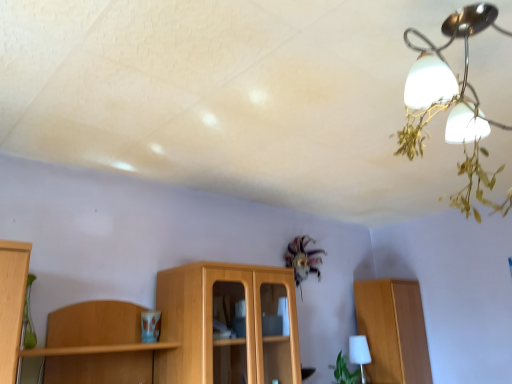
At what (x,y) coordinates should I click in order to perform the action: click on white matte table lamp at lower right. Please return your answer as a coordinate pair (x, y). This screenshot has width=512, height=384. Looking at the image, I should click on (359, 353).

The height and width of the screenshot is (384, 512). I want to click on satin silver chandelier at upper right, so click(x=451, y=103).

Is satin silver chandelier at upper right far away from white matte table lamp at lower right?

Yes, satin silver chandelier at upper right and white matte table lamp at lower right are located far from each other.

Could you tell me if satin silver chandelier at upper right is facing white matte table lamp at lower right?

No, satin silver chandelier at upper right is not oriented towards white matte table lamp at lower right.

Does point (486, 152) come in front of point (350, 348)?

That is True.

At what (x,y) coordinates should I click in order to perform the action: click on lamp above the white matte table lamp at lower right (from the image's perspective). Please return your answer as a coordinate pair (x, y). This screenshot has width=512, height=384. Looking at the image, I should click on (451, 103).

Can you confirm if white matte table lamp at lower right is taller than satin silver chandelier at upper right?

In fact, white matte table lamp at lower right may be shorter than satin silver chandelier at upper right.

In the scene shown: Would you say white matte table lamp at lower right is inside or outside satin silver chandelier at upper right?

white matte table lamp at lower right cannot be found inside satin silver chandelier at upper right.

Which is farther from the camera, (362, 336) or (410, 121)?

Positioned behind is point (362, 336).

Is white matte table lamp at lower right completely or partially outside of green leafy plant at lower right?

Yes, white matte table lamp at lower right is located beyond the bounds of green leafy plant at lower right.

Can you confirm if white matte table lamp at lower right is taller than green leafy plant at lower right?

Yes, white matte table lamp at lower right is taller than green leafy plant at lower right.

Considering the sizes of wooden cabinet at right and white matte table lamp at lower right in the image, is wooden cabinet at right taller or shorter than white matte table lamp at lower right?

Considering their sizes, wooden cabinet at right has more height than white matte table lamp at lower right.

Is wooden cabinet at right placed right next to white matte table lamp at lower right?

No, wooden cabinet at right is not making contact with white matte table lamp at lower right.

Which is behind, point (368, 336) or point (362, 368)?

The point (368, 336) is behind.

Considering the relative positions of satin silver chandelier at upper right and wooden cabinet at right in the image provided, is satin silver chandelier at upper right to the left or to the right of wooden cabinet at right?

Clearly, satin silver chandelier at upper right is on the left of wooden cabinet at right in the image.

In the scene shown: Which object is closer to the camera taking this photo, satin silver chandelier at upper right or wooden cabinet at right?

satin silver chandelier at upper right is in front.

From the image's perspective, is satin silver chandelier at upper right located above or below wooden cabinet at right?

Clearly, from the image's perspective, satin silver chandelier at upper right is above wooden cabinet at right.

At what (x,y) coordinates should I click in order to perform the action: click on plant located in front of the white matte table lamp at lower right. Please return your answer as a coordinate pair (x, y). Image resolution: width=512 pixels, height=384 pixels. Looking at the image, I should click on (345, 371).

Looking at the image, does green leafy plant at lower right seem bigger or smaller compared to white matte table lamp at lower right?

Considering their sizes, green leafy plant at lower right takes up more space than white matte table lamp at lower right.

Is green leafy plant at lower right oriented towards white matte table lamp at lower right?

No.

In the scene shown: Is green leafy plant at lower right situated inside white matte table lamp at lower right or outside?

green leafy plant at lower right is spatially situated outside white matte table lamp at lower right.

Does wooden cabinet at right have a greater height compared to green leafy plant at lower right?

Yes, wooden cabinet at right is taller than green leafy plant at lower right.

From the image's perspective, does wooden cabinet at right appear higher than green leafy plant at lower right?

Yes, from the image's perspective, wooden cabinet at right is on top of green leafy plant at lower right.

In the image, is wooden cabinet at right positioned in front of or behind green leafy plant at lower right?

Visually, wooden cabinet at right is located behind green leafy plant at lower right.

Where is `lamp above the white matte table lamp at lower right (from a real-world perspective)`? This screenshot has width=512, height=384. lamp above the white matte table lamp at lower right (from a real-world perspective) is located at coordinates (451, 103).

Where is `table lamp behind the satin silver chandelier at upper right`? This screenshot has height=384, width=512. table lamp behind the satin silver chandelier at upper right is located at coordinates (359, 353).

Which object lies nearer to the anchor point white matte table lamp at lower right, green leafy plant at lower right or wooden cabinet at right?

The object closer to white matte table lamp at lower right is green leafy plant at lower right.

Which object lies nearer to the anchor point white matte table lamp at lower right, green leafy plant at lower right or satin silver chandelier at upper right?

green leafy plant at lower right lies closer to white matte table lamp at lower right than the other object.

Based on their spatial positions, is wooden cabinet at right or green leafy plant at lower right further from white matte table lamp at lower right?

wooden cabinet at right.

Which object lies further to the anchor point satin silver chandelier at upper right, green leafy plant at lower right or wooden cabinet at right?

green leafy plant at lower right is positioned further to the anchor satin silver chandelier at upper right.

Considering their positions, is satin silver chandelier at upper right positioned closer to green leafy plant at lower right than white matte table lamp at lower right?

Among the two, white matte table lamp at lower right is located nearer to green leafy plant at lower right.

Which object lies nearer to the anchor point satin silver chandelier at upper right, wooden cabinet at right or green leafy plant at lower right?

wooden cabinet at right is closer to satin silver chandelier at upper right.

Considering their positions, is satin silver chandelier at upper right positioned further to green leafy plant at lower right than wooden cabinet at right?

Among the two, satin silver chandelier at upper right is located further to green leafy plant at lower right.

When comparing their distances from white matte table lamp at lower right, does wooden cabinet at right or satin silver chandelier at upper right seem closer?

Among the two, wooden cabinet at right is located nearer to white matte table lamp at lower right.

Locate an element on the screen. plant between satin silver chandelier at upper right and wooden cabinet at right in the front-back direction is located at coordinates (345, 371).

Where is `plant between satin silver chandelier at upper right and white matte table lamp at lower right in the front-back direction`? This screenshot has height=384, width=512. plant between satin silver chandelier at upper right and white matte table lamp at lower right in the front-back direction is located at coordinates (345, 371).

The image size is (512, 384). Identify the location of table lamp located between satin silver chandelier at upper right and wooden cabinet at right in the depth direction. (359, 353).

This screenshot has width=512, height=384. Identify the location of table lamp between green leafy plant at lower right and wooden cabinet at right. (359, 353).